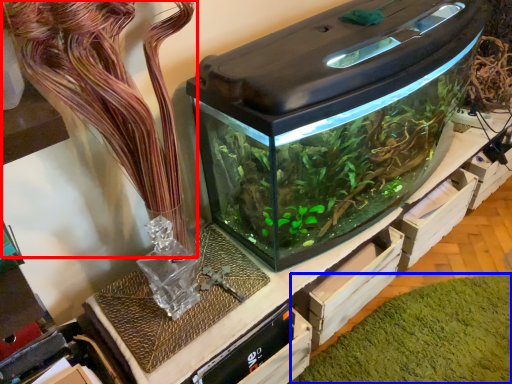
Question: Which of the following is the closest to the observer, plant (highlighted by a red box) or algae (highlighted by a blue box)?

Choices:
 (A) plant
 (B) algae

Answer: (A)